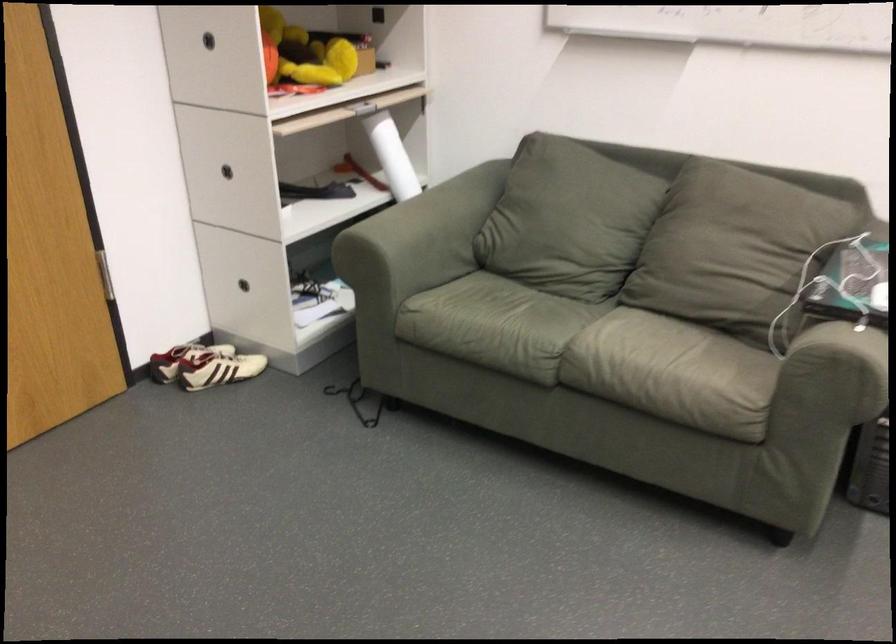
Identify the location of white and black shoe. This screenshot has width=896, height=644. (218, 368).